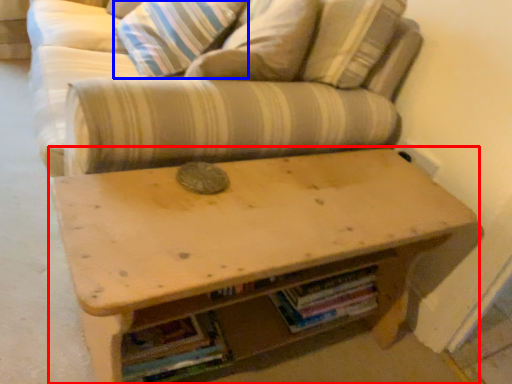
Question: Which object is closer to the camera taking this photo, table (highlighted by a red box) or pillow (highlighted by a blue box)?

Choices:
 (A) table
 (B) pillow

Answer: (A)